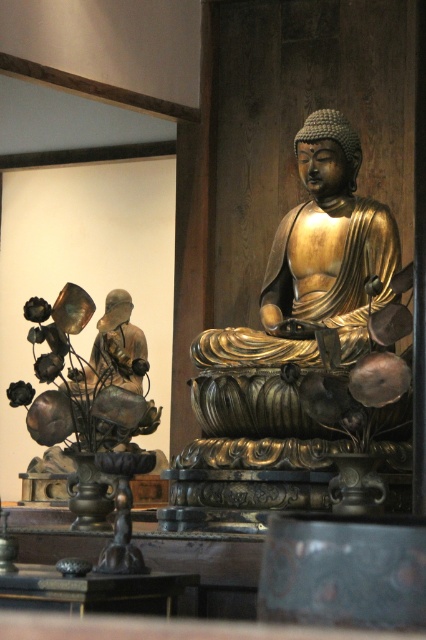
You are a photographer standing at a certain distance from the gold polished bronze buddha at center. You want to capture a closeup shot of the statue without moving closer. Which camera setting should you adjust to achieve this?

You should adjust the zoom setting on your camera to increase the magnification, allowing you to capture a closeup of the gold polished bronze buddha at center from 18.53 meters away without moving closer.

You are an interior designer planning to place a new decorative item in the space. The item is 1.2 meters tall. You have two options for placement locations based on the existing objects in the scene. The first option is next to the matte black statue at left, and the second is next to the black polished wood table at center. Which location would be more appropriate for the item in terms of scale compatibility?

The matte black statue at left is larger in size than the black polished wood table at center, so placing the 1.2 meter tall item next to the matte black statue at left would be more appropriate for scale compatibility.

You are an interior designer planning to place a new decorative item on the black polished wood table at center. Considering the size of the matte black statue at left, will the table be able to accommodate the new item without overcrowding?

The matte black statue at left is wider than the black polished wood table at center, so placing another item on the table may lead to overcrowding and is not recommended.